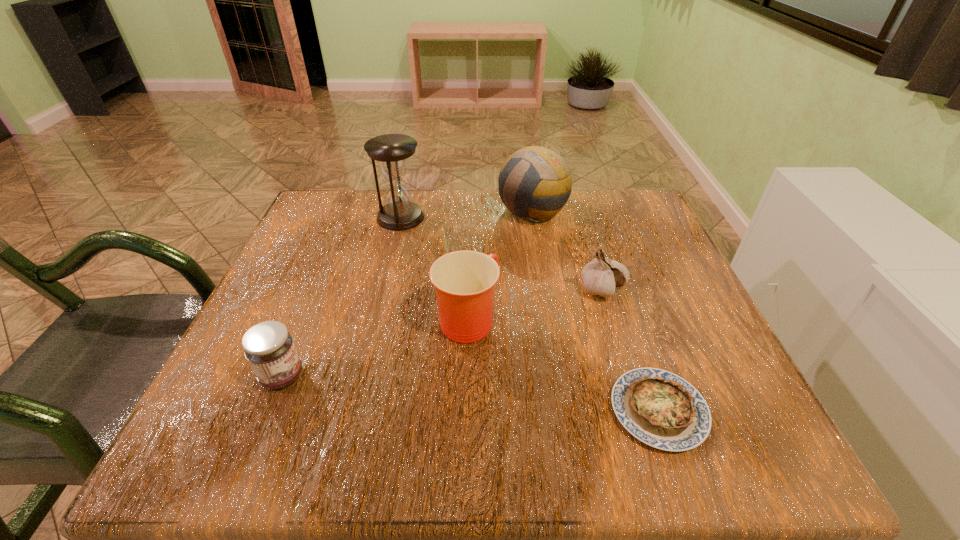
I want to click on free space located on the front label of the jam, so click(470, 376).

Find the location of a particular element. This screenshot has height=540, width=960. free space located 0.120m on the left of the quiche is located at coordinates (532, 410).

This screenshot has width=960, height=540. Identify the location of hourglass present at the far edge. (391, 151).

Where is `volleyball located in the far edge section of the desktop`? The height and width of the screenshot is (540, 960). volleyball located in the far edge section of the desktop is located at coordinates (539, 178).

This screenshot has width=960, height=540. I want to click on object present at the near edge, so click(x=661, y=409).

Identify the location of object situated at the left edge. The image size is (960, 540). (268, 346).

Where is `garlic that is positioned at the right edge`? garlic that is positioned at the right edge is located at coordinates (601, 276).

Locate an element on the screen. quiche at the right edge is located at coordinates (661, 409).

The image size is (960, 540). I want to click on object that is at the near right corner, so click(661, 409).

The height and width of the screenshot is (540, 960). In the image, there is a desktop. In order to click on free space at the far edge in this screenshot , I will do `click(439, 197)`.